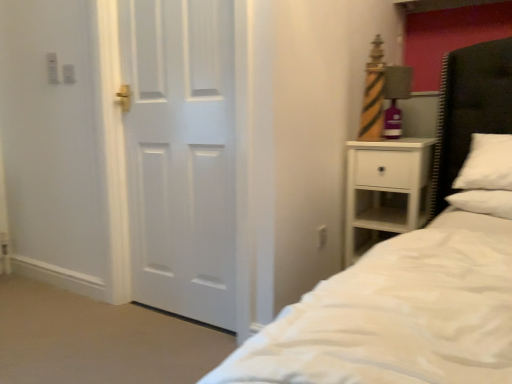
Question: Is white glossy door at left facing towards matte striped lamp at right?

Choices:
 (A) yes
 (B) no

Answer: (B)

Question: Considering the relative sizes of white glossy door at left and matte striped lamp at right in the image provided, is white glossy door at left smaller than matte striped lamp at right?

Choices:
 (A) yes
 (B) no

Answer: (B)

Question: Considering the relative sizes of white glossy door at left and matte striped lamp at right in the image provided, is white glossy door at left taller than matte striped lamp at right?

Choices:
 (A) yes
 (B) no

Answer: (A)

Question: Are white glossy door at left and matte striped lamp at right far apart?

Choices:
 (A) no
 (B) yes

Answer: (B)

Question: Is matte striped lamp at right at the back of white glossy door at left?

Choices:
 (A) no
 (B) yes

Answer: (A)

Question: From the image's perspective, is white glossy door at left positioned above or below black leather headboard at right?

Choices:
 (A) below
 (B) above

Answer: (A)

Question: Relative to black leather headboard at right, is white glossy door at left in front or behind?

Choices:
 (A) front
 (B) behind

Answer: (A)

Question: From a real-world perspective, is white glossy door at left physically located above or below black leather headboard at right?

Choices:
 (A) below
 (B) above

Answer: (B)

Question: Considering the positions of white glossy door at left and black leather headboard at right in the image, is white glossy door at left bigger or smaller than black leather headboard at right?

Choices:
 (A) big
 (B) small

Answer: (A)

Question: Would you say black leather headboard at right is inside or outside white matte nightstand at right?

Choices:
 (A) outside
 (B) inside

Answer: (A)

Question: Is black leather headboard at right bigger or smaller than white matte nightstand at right?

Choices:
 (A) small
 (B) big

Answer: (A)

Question: From the image's perspective, relative to white matte nightstand at right, is black leather headboard at right above or below?

Choices:
 (A) above
 (B) below

Answer: (A)

Question: Is point (503, 81) positioned closer to the camera than point (349, 240)?

Choices:
 (A) farther
 (B) closer

Answer: (B)

Question: From a real-world perspective, relative to matte striped lamp at right, is white matte nightstand at right vertically above or below?

Choices:
 (A) below
 (B) above

Answer: (A)

Question: In terms of size, does white matte nightstand at right appear bigger or smaller than matte striped lamp at right?

Choices:
 (A) big
 (B) small

Answer: (A)